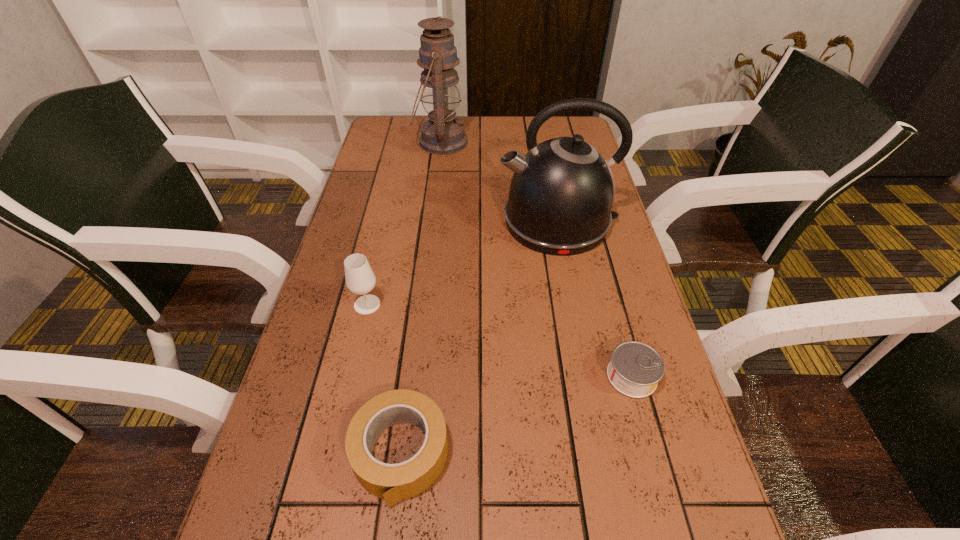
This screenshot has height=540, width=960. In order to click on vacant space located 0.360m on the spout of the fourth nearest object in this screenshot , I will do `click(369, 221)`.

What are the coordinates of `vacant space located on the spout of the fourth nearest object` in the screenshot? It's located at (458, 221).

The height and width of the screenshot is (540, 960). In order to click on free spot located on the front of the third nearest object in this screenshot , I will do `click(324, 487)`.

Where is `free space located 0.270m on the back of the fourth farthest object`? Image resolution: width=960 pixels, height=540 pixels. free space located 0.270m on the back of the fourth farthest object is located at coordinates (601, 265).

Locate an element on the screen. This screenshot has width=960, height=540. object situated at the far edge is located at coordinates (442, 134).

Find the location of a particular element. The height and width of the screenshot is (540, 960). oil lamp located in the left edge section of the desktop is located at coordinates (442, 134).

Identify the location of glass positioned at the left edge. (360, 279).

Find the location of a particular element. Image resolution: width=960 pixels, height=540 pixels. duct tape located in the left edge section of the desktop is located at coordinates (392, 482).

The height and width of the screenshot is (540, 960). Identify the location of kettle that is positioned at the right edge. (561, 194).

You are a GUI agent. You are given a task and a screenshot of the screen. Output one action in this format:
    pyautogui.click(x=<x>, y=<y>)
    Task: Click on the can located at the right edge
    The image size is (960, 540).
    Given the screenshot: What is the action you would take?
    [635, 369]